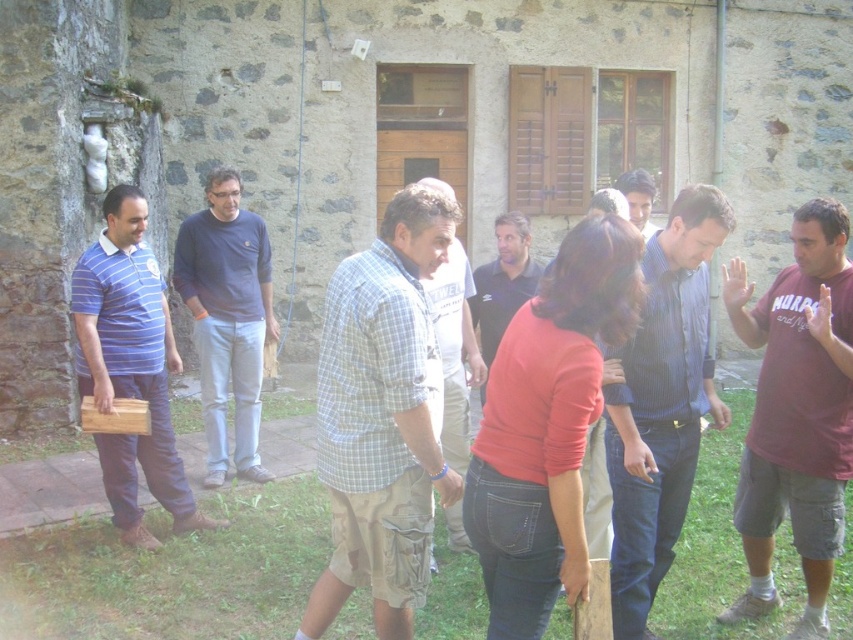
Does plaid cotton shirt at center appear on the left side of blue striped shirt at center?

Indeed, plaid cotton shirt at center is positioned on the left side of blue striped shirt at center.

Can you confirm if plaid cotton shirt at center is positioned above blue striped shirt at center?

Yes, plaid cotton shirt at center is above blue striped shirt at center.

This screenshot has height=640, width=853. What do you see at coordinates (381, 417) in the screenshot?
I see `plaid cotton shirt at center` at bounding box center [381, 417].

Where is `plaid cotton shirt at center`? plaid cotton shirt at center is located at coordinates 381,417.

Is checkered fabric shirt at center to the left of smooth brown shirt at center from the viewer's perspective?

Yes, checkered fabric shirt at center is to the left of smooth brown shirt at center.

Describe the element at coordinates (454, 349) in the screenshot. The width and height of the screenshot is (853, 640). I see `checkered fabric shirt at center` at that location.

This screenshot has height=640, width=853. I want to click on checkered fabric shirt at center, so click(x=454, y=349).

Is point (379, 305) positioned before point (460, 250)?

Yes, point (379, 305) is in front of point (460, 250).

Who is taller, plaid cotton shirt at center or checkered fabric shirt at center?

With more height is plaid cotton shirt at center.

Where is `plaid cotton shirt at center`? plaid cotton shirt at center is located at coordinates (381, 417).

Locate an element on the screen. This screenshot has height=640, width=853. plaid cotton shirt at center is located at coordinates (381, 417).